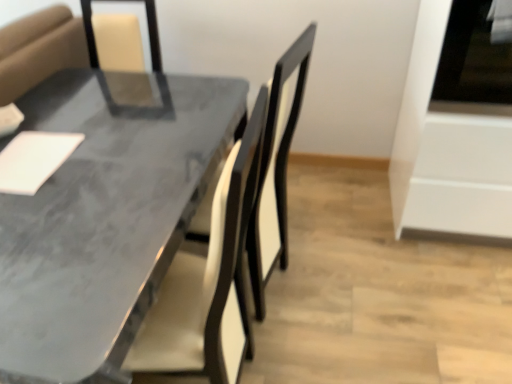
The image size is (512, 384). I want to click on free spot above marble gray table at center (from a real-world perspective), so (83, 162).